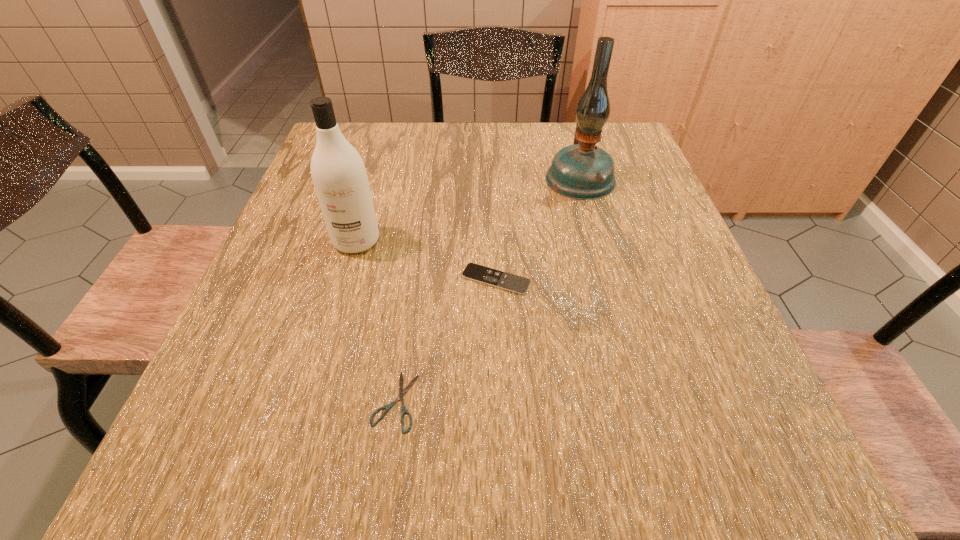
This screenshot has height=540, width=960. I want to click on oil lamp, so click(583, 171).

In order to click on the farthest object in this screenshot , I will do `click(583, 171)`.

Where is `the third nearest object`? the third nearest object is located at coordinates (338, 172).

Where is `the leftmost object`? This screenshot has width=960, height=540. the leftmost object is located at coordinates (338, 172).

I want to click on the second shortest object, so click(475, 272).

Where is `the second nearest object`? the second nearest object is located at coordinates (475, 272).

You are a GUI agent. You are given a task and a screenshot of the screen. Output one action in this format:
    pyautogui.click(x=<x>, y=<y>)
    Task: Click on the third object from right to left
    This screenshot has height=540, width=960.
    Given the screenshot: What is the action you would take?
    pyautogui.click(x=402, y=392)

Find the location of `shears`. shears is located at coordinates (402, 392).

Identify the location of free space located on the front of the oil lamp. (596, 236).

At what (x,y) coordinates should I click in order to perform the action: click on free region located on the front-facing side of the shampoo. Please return your answer as a coordinate pair (x, y). Looking at the image, I should click on (341, 293).